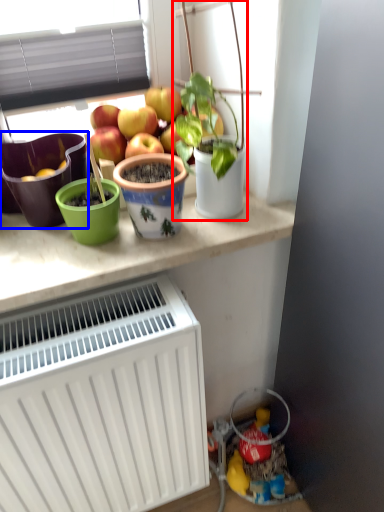
Question: Which object is closer to the camera taking this photo, houseplant (highlighted by a red box) or flowerpot (highlighted by a blue box)?

Choices:
 (A) houseplant
 (B) flowerpot

Answer: (A)